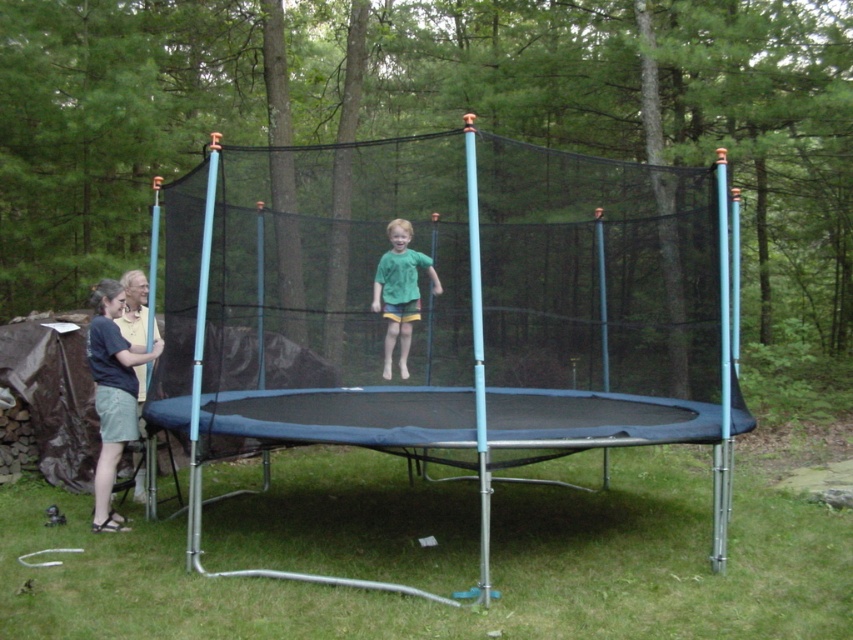
You are standing at the center of the trampoline and want to locate the point with coordinates point (454, 314). According to the scene, where exactly is this point located?

The point (454, 314) is located on the black mesh net at center.

You are a photographer trying to capture a clear shot of the green matte shirt at center and the black mesh net at center. Based on their positions, which object will appear larger in your photo?

The black mesh net at center is closer to the viewer than the green matte shirt at center, so it will appear larger in the photo.

You are standing at the camera position and want to throw a ball to the black mesh net at center. If your throwing range is 4 meters, can you reach it?

The distance between you and the black mesh net at center is 4.35 meters, which is beyond your throwing range of 4 meters. Therefore, you cannot reach it.